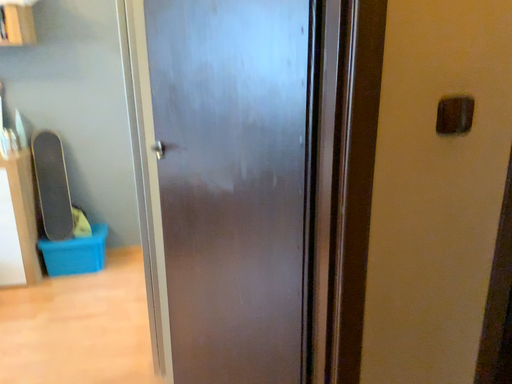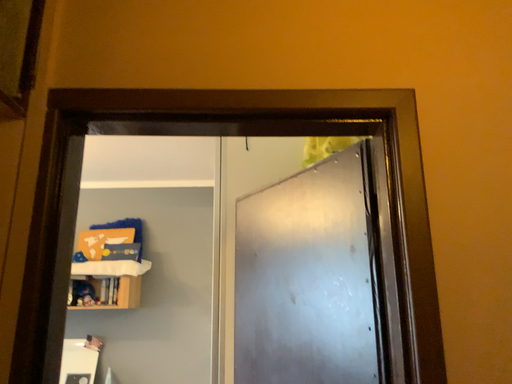
Question: Which way did the camera rotate in the video?

Choices:
 (A) rotated left
 (B) rotated right

Answer: (A)